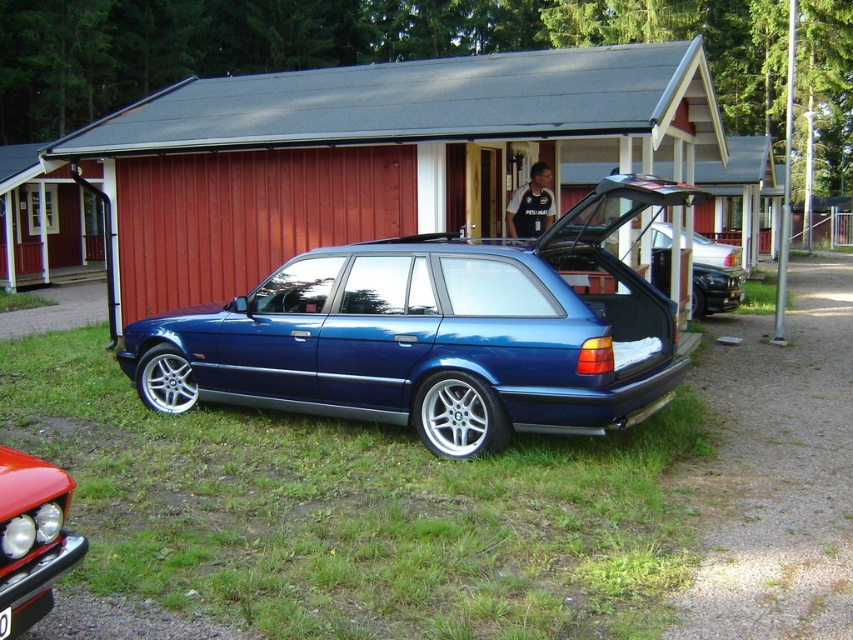
Who is higher up, wooden hut at center or wooden door at center?

wooden hut at center is higher up.

Does wooden hut at center appear under wooden door at center?

Incorrect, wooden hut at center is not positioned below wooden door at center.

Who is more forward, (325, 173) or (100, 166)?

Point (325, 173)

Locate an element on the screen. This screenshot has width=853, height=640. wooden hut at center is located at coordinates (366, 154).

How far apart are dark blue jersey at center and black plastic license plate at center?

26.28 feet

Who is shorter, dark blue jersey at center or black plastic license plate at center?

Standing shorter between the two is black plastic license plate at center.

What do you see at coordinates (531, 204) in the screenshot?
I see `dark blue jersey at center` at bounding box center [531, 204].

The height and width of the screenshot is (640, 853). Identify the location of dark blue jersey at center. (531, 204).

Based on the photo, which is more to the left, wooden door at center or dark blue jersey at center?

Positioned to the left is wooden door at center.

Can you confirm if wooden door at center is shorter than dark blue jersey at center?

Correct, wooden door at center is not as tall as dark blue jersey at center.

Image resolution: width=853 pixels, height=640 pixels. What do you see at coordinates (45, 221) in the screenshot?
I see `wooden door at center` at bounding box center [45, 221].

Where is `wooden door at center`? This screenshot has height=640, width=853. wooden door at center is located at coordinates (45, 221).